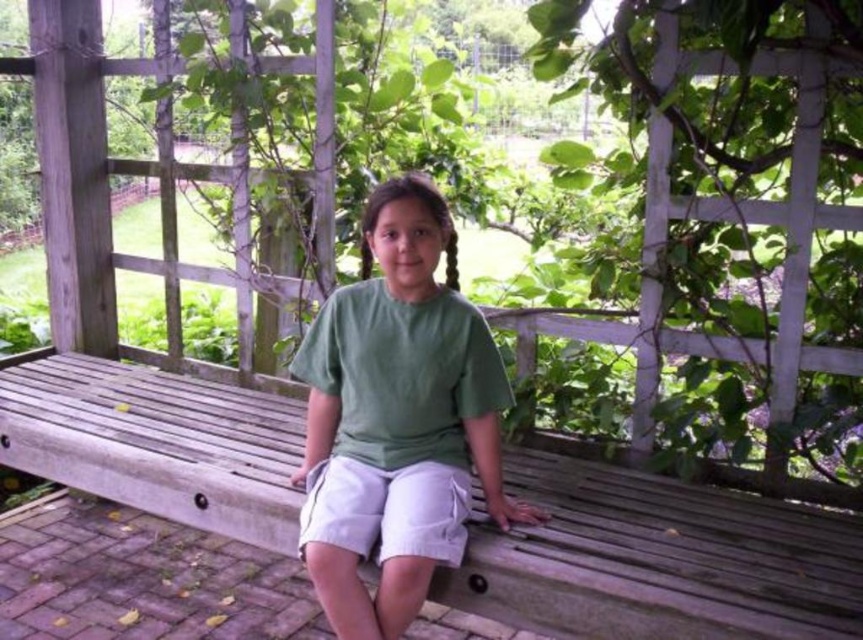
Can you confirm if wooden bench at center is positioned to the left of green cotton shirt at center?

Indeed, wooden bench at center is positioned on the left side of green cotton shirt at center.

This screenshot has width=863, height=640. Describe the element at coordinates (658, 561) in the screenshot. I see `wooden bench at center` at that location.

Locate an element on the screen. This screenshot has width=863, height=640. wooden bench at center is located at coordinates (658, 561).